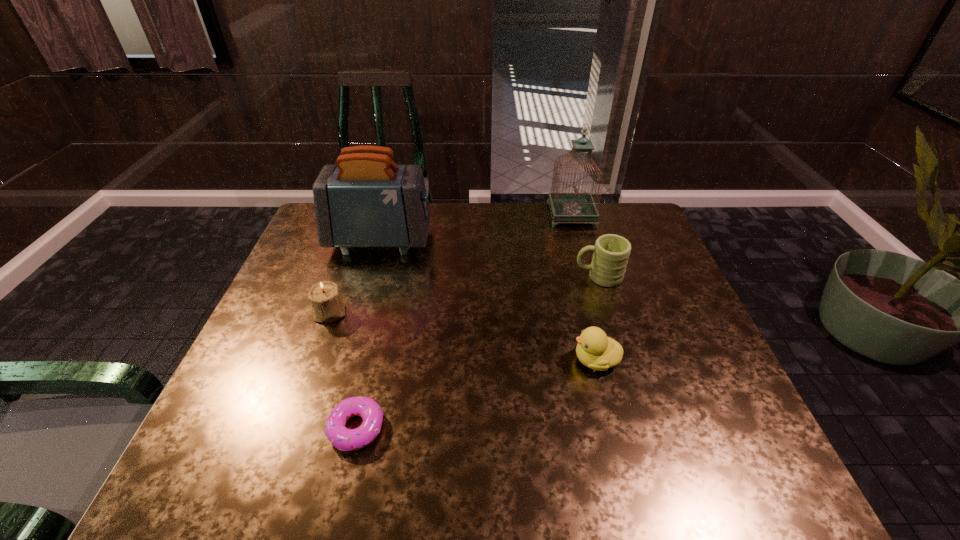
The image size is (960, 540). In the image, there is a desktop. What are the coordinates of `free space at the right edge` in the screenshot? It's located at (685, 419).

The width and height of the screenshot is (960, 540). In order to click on free region at the far right corner of the desktop in this screenshot , I will do `click(628, 228)`.

I want to click on free space at the near right corner of the desktop, so click(706, 485).

This screenshot has height=540, width=960. Identify the location of empty space that is in between the duckling and the doughnut. (476, 394).

This screenshot has width=960, height=540. Identify the location of blank region between the birdcage and the toaster. (476, 227).

The height and width of the screenshot is (540, 960). Find the location of `empty space that is in between the candle_holder and the fourth nearest object`. empty space that is in between the candle_holder and the fourth nearest object is located at coordinates (464, 295).

Find the location of `free space between the shortest object and the birdcage`. free space between the shortest object and the birdcage is located at coordinates (464, 321).

Where is `free spot between the fourth nearest object and the birdcage`? The image size is (960, 540). free spot between the fourth nearest object and the birdcage is located at coordinates (585, 246).

You are a GUI agent. You are given a task and a screenshot of the screen. Output one action in this format:
    pyautogui.click(x=<x>, y=<y>)
    Task: Click on the unoccupied area between the doughnut and the birdcage
    This screenshot has width=960, height=540.
    Given the screenshot: What is the action you would take?
    pyautogui.click(x=464, y=321)

This screenshot has width=960, height=540. Find the location of `vacant space in between the fourth nearest object and the toaster`. vacant space in between the fourth nearest object and the toaster is located at coordinates (490, 259).